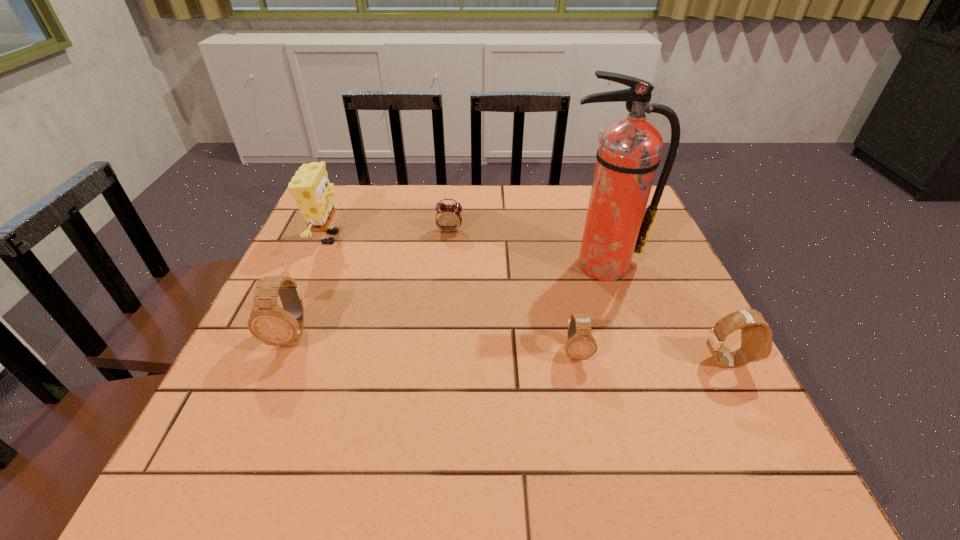
I want to click on the fourth shortest object, so click(268, 322).

Find the location of a particular element. This screenshot has width=960, height=540. the tallest watch is located at coordinates (268, 322).

The width and height of the screenshot is (960, 540). Find the location of `the second watch from left to right`. the second watch from left to right is located at coordinates (580, 345).

Identify the location of the rightmost object. This screenshot has width=960, height=540. (756, 336).

Locate an element on the screen. Image resolution: width=960 pixels, height=540 pixels. the fourth tallest object is located at coordinates (756, 336).

Image resolution: width=960 pixels, height=540 pixels. In order to click on the fifth shortest object in this screenshot , I will do `click(310, 187)`.

Identify the location of fire extinguisher. point(617,225).

Identify the location of alarm clock. (448, 218).

This screenshot has width=960, height=540. In order to click on vacant point located on the face of the leftmost watch in this screenshot , I will do `click(275, 377)`.

This screenshot has height=540, width=960. I want to click on vacant region located on the face of the shortest watch, so click(583, 389).